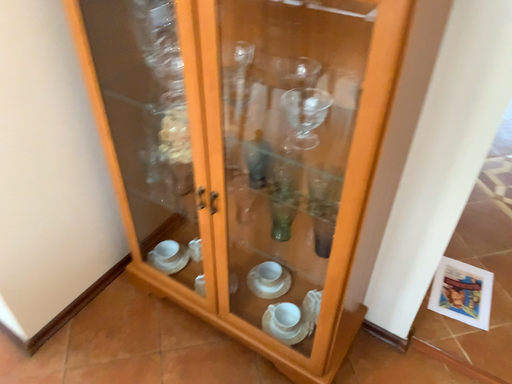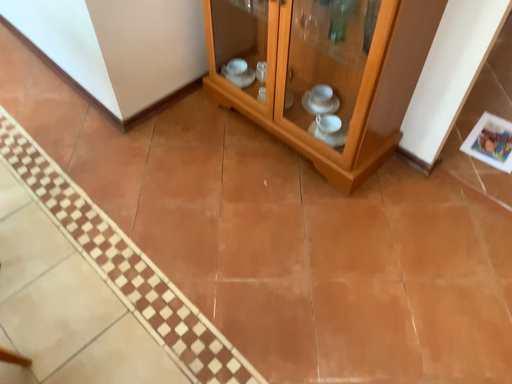
Question: How did the camera likely rotate when shooting the video?

Choices:
 (A) rotated downward
 (B) rotated upward

Answer: (A)